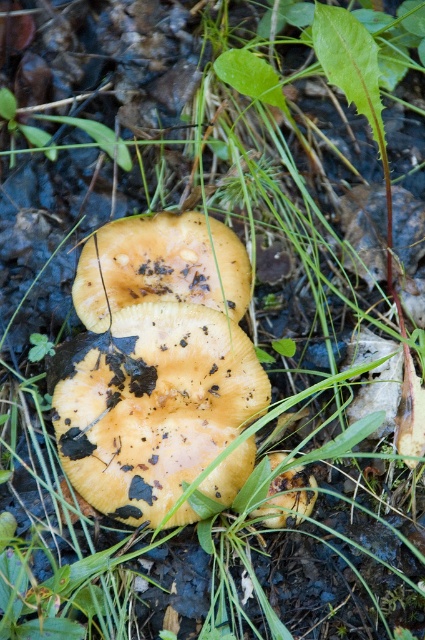
You are observing two points in the image of the mushrooms. From your perspective, which point is nearer to you, point (158, 417) or point (240, 269)?

Point (158, 417) is closer to the viewer than point (240, 269).